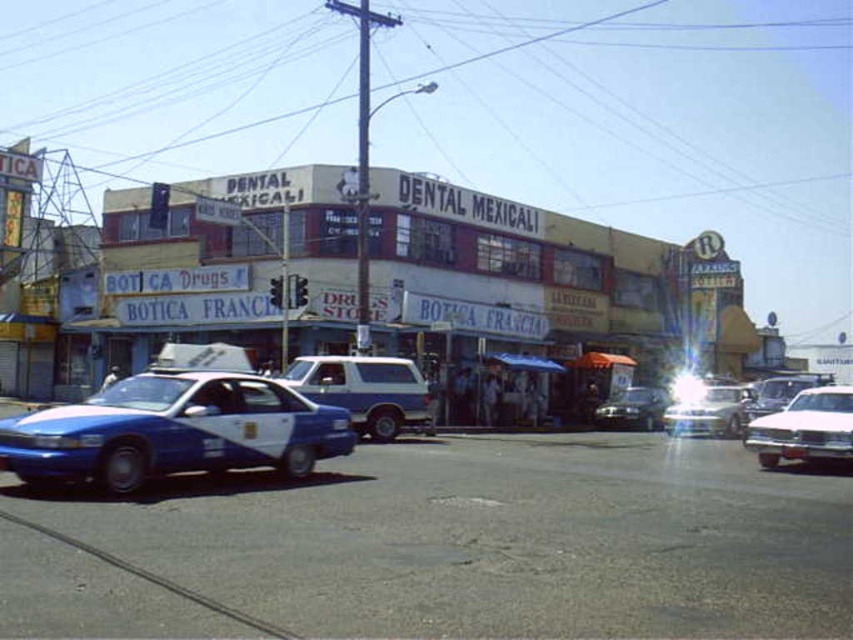
Question: Can you confirm if blue glossy sedan at lower left is smaller than metallic silver car at center?

Choices:
 (A) yes
 (B) no

Answer: (A)

Question: Can you confirm if white matte building at center is positioned below pink glossy sedan at right?

Choices:
 (A) yes
 (B) no

Answer: (B)

Question: Which object is farther from the camera taking this photo?

Choices:
 (A) white matte building at center
 (B) pink glossy sedan at right

Answer: (A)

Question: Estimate the real-world distances between objects in this image. Which object is farther from the blue glossy sedan at lower left?

Choices:
 (A) shiny silver sedan at center
 (B) white matte building at center

Answer: (A)

Question: Which is nearer to the shiny silver sedan at center?

Choices:
 (A) pink glossy sedan at right
 (B) white matte building at center
 (C) metallic silver car at center

Answer: (C)

Question: In this image, where is white matte building at center located relative to pink glossy sedan at right?

Choices:
 (A) below
 (B) above

Answer: (B)